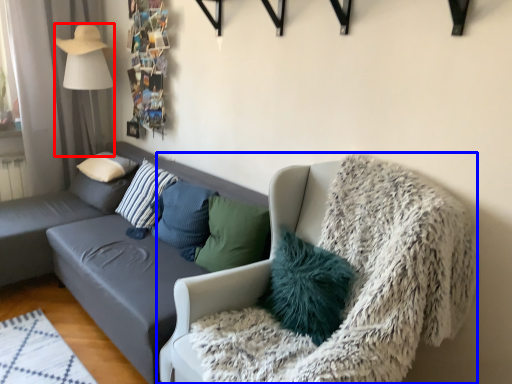
Question: Which object appears closest to the camera in this image, lamp (highlighted by a red box) or chair (highlighted by a blue box)?

Choices:
 (A) lamp
 (B) chair

Answer: (B)